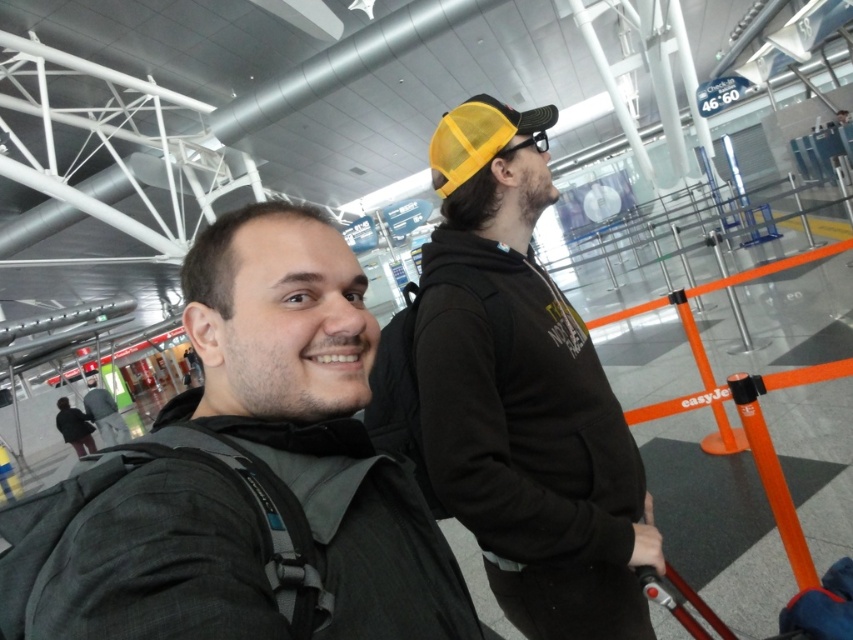
Can you confirm if dark gray backpack at center is positioned to the left of matte black hoodie at center?

Yes, dark gray backpack at center is to the left of matte black hoodie at center.

Who is more forward, (251, 604) or (370, 380)?

Point (251, 604) is in front.

Where is `dark gray backpack at center`? This screenshot has width=853, height=640. dark gray backpack at center is located at coordinates (315, 417).

Is dark gray backpack at center thinner than yellow mesh cap at upper center?

Incorrect, dark gray backpack at center's width is not less than yellow mesh cap at upper center's.

The image size is (853, 640). I want to click on dark gray backpack at center, so click(315, 417).

I want to click on dark gray backpack at center, so click(x=315, y=417).

Which of these two, matte black hoodie at center or yellow mesh cap at upper center, stands shorter?

yellow mesh cap at upper center is shorter.

Which is in front, point (444, 321) or point (474, 156)?

Positioned in front is point (444, 321).

Identify the location of matte black hoodie at center. (521, 394).